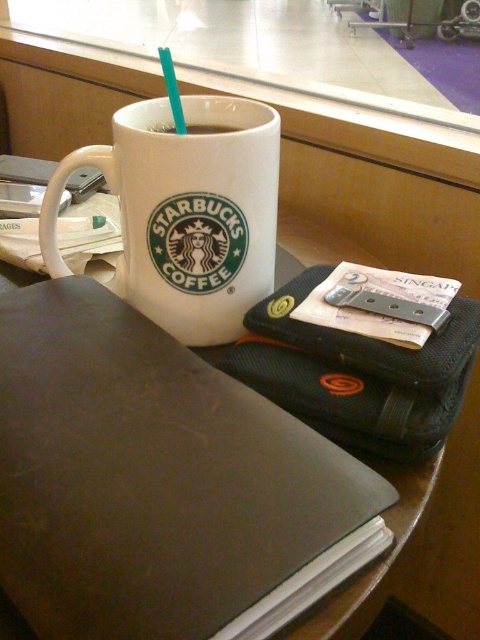
Is leather-like brown binder at center-left smaller than teal plastic straw at upper center?

Correct, leather-like brown binder at center-left occupies less space than teal plastic straw at upper center.

Between point (327, 544) and point (164, 49), which one is positioned behind?

The point (164, 49) is behind.

Find the location of a particular element. The height and width of the screenshot is (640, 480). leather-like brown binder at center-left is located at coordinates (149, 476).

Does white matte starbucks coffee cup at upper center have a lesser height compared to white glossy mug at upper center?

Incorrect, white matte starbucks coffee cup at upper center's height does not fall short of white glossy mug at upper center's.

Is point (194, 138) farther from viewer compared to point (170, 131)?

No, (194, 138) is closer to viewer.

The image size is (480, 640). Identify the location of white matte starbucks coffee cup at upper center. (186, 212).

Who is more forward, [139,282] or [179,120]?

Positioned in front is point [179,120].

Is white matte starbucks coffee cup at upper center wider than teal plastic straw at upper center?

Yes.

Is point (176, 284) in front of point (168, 58)?

That is True.

Image resolution: width=480 pixels, height=640 pixels. I want to click on white matte starbucks coffee cup at upper center, so click(x=186, y=212).